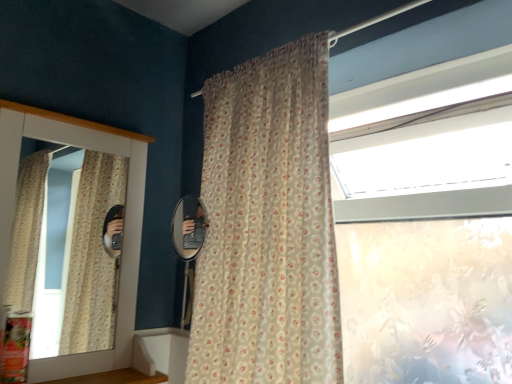
Question: Considering their positions, is translucent floral-patterned curtain at center located in front of or behind matte white medicine cabinet at left?

Choices:
 (A) front
 (B) behind

Answer: (A)

Question: Visually, is translucent floral-patterned curtain at center positioned to the left or to the right of matte white medicine cabinet at left?

Choices:
 (A) right
 (B) left

Answer: (A)

Question: Based on their relative distances, which object is nearer to the wooden at lower left?

Choices:
 (A) matte white medicine cabinet at left
 (B) translucent floral-patterned curtain at center

Answer: (A)

Question: Which object is positioned farthest from the translucent floral-patterned curtain at center?

Choices:
 (A) wooden at lower left
 (B) matte white medicine cabinet at left

Answer: (A)